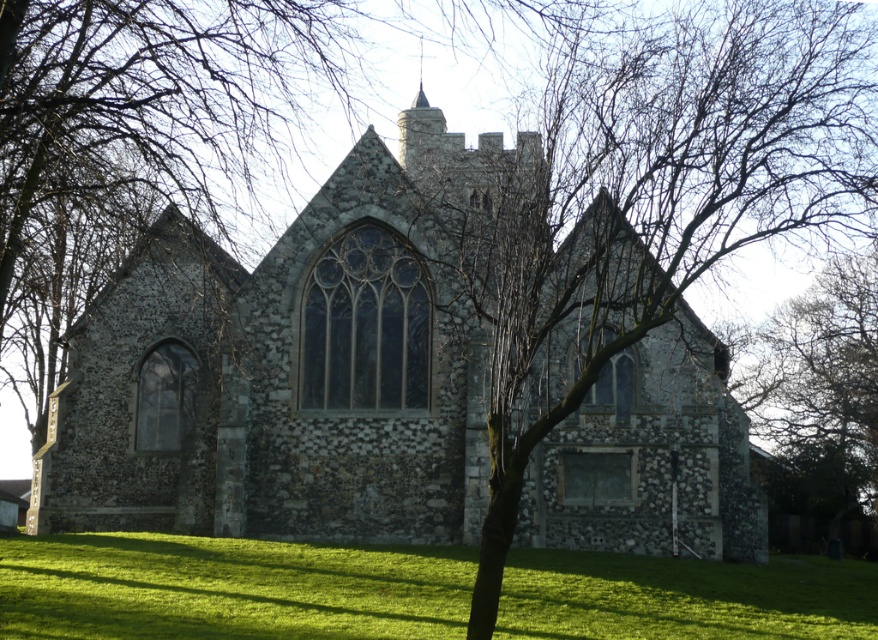
Can you confirm if stone church at center is thinner than green grass at lower center?

Correct, stone church at center's width is less than green grass at lower center's.

Image resolution: width=878 pixels, height=640 pixels. Describe the element at coordinates (283, 374) in the screenshot. I see `stone church at center` at that location.

Image resolution: width=878 pixels, height=640 pixels. Find the location of `stone church at center`. stone church at center is located at coordinates (x=283, y=374).